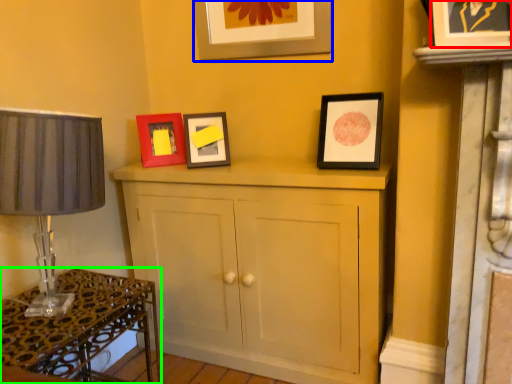
Question: Based on their relative distances, which object is nearer to picture frame (highlighted by a red box)? Choose from picture frame (highlighted by a blue box) and table (highlighted by a green box).

Choices:
 (A) picture frame
 (B) table

Answer: (A)